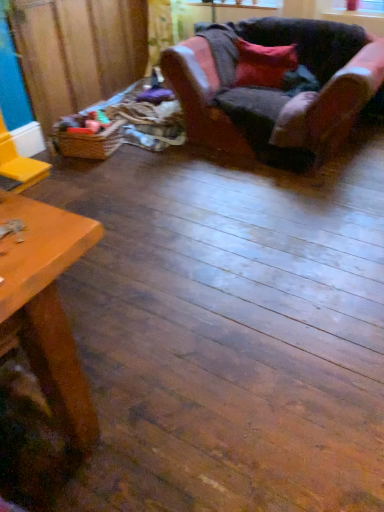
The height and width of the screenshot is (512, 384). Find the location of `brown woven basket at left`. brown woven basket at left is located at coordinates (77, 51).

Find the location of a particular element. The height and width of the screenshot is (512, 384). velvet-like pink armchair at upper right is located at coordinates (277, 90).

Image resolution: width=384 pixels, height=512 pixels. I want to click on plywood above the velvet-like pink armchair at upper right (from the image's perspective), so click(x=77, y=51).

How different are the orientations of velvet-like pink armchair at upper right and brown woven basket at left in degrees?

89.8 degrees separate the facing orientations of velvet-like pink armchair at upper right and brown woven basket at left.

From a real-world perspective, which is physically below, velvet-like pink armchair at upper right or brown woven basket at left?

velvet-like pink armchair at upper right, from a real-world perspective.

Choose the correct answer: Is velvet-like pink armchair at upper right inside brown woven basket at left or outside it?

velvet-like pink armchair at upper right exists outside the volume of brown woven basket at left.

Is woven brown basket at left next to velvet red pillow at upper right?

No.

From the image's perspective, who appears lower, woven brown basket at left or velvet red pillow at upper right?

woven brown basket at left, from the image's perspective.

From a real-world perspective, is woven brown basket at left under velvet red pillow at upper right?

Yes, from a real-world perspective, woven brown basket at left is under velvet red pillow at upper right.

Between woven brown basket at left and velvet red pillow at upper right, which one has more height?

velvet red pillow at upper right is taller.

Can we say woven brown basket at left lies outside velvet-like pink armchair at upper right?

Yes, woven brown basket at left is outside of velvet-like pink armchair at upper right.

What's the angular difference between woven brown basket at left and velvet-like pink armchair at upper right's facing directions?

104 degrees.

Which is more to the left, woven brown basket at left or velvet-like pink armchair at upper right?

woven brown basket at left.

Is point (107, 135) farther from camera compared to point (221, 25)?

No, it is in front of (221, 25).

The height and width of the screenshot is (512, 384). Find the location of `chair on the left of transparent plastic window screen at upper center`. chair on the left of transparent plastic window screen at upper center is located at coordinates (277, 90).

Does velvet-like pink armchair at upper right lie behind transparent plastic window screen at upper center?

No, it is in front of transparent plastic window screen at upper center.

Is velvet-like pink armchair at upper right turned away from transparent plastic window screen at upper center?

Yes, velvet-like pink armchair at upper right is facing away from transparent plastic window screen at upper center.

How much distance is there between velvet red pillow at upper right and woven brown basket at left?

They are 1.16 meters apart.

Would you say velvet red pillow at upper right is inside or outside woven brown basket at left?

velvet red pillow at upper right is spatially situated outside woven brown basket at left.

Where is `pillow above the woven brown basket at left (from the image's perspective)`? pillow above the woven brown basket at left (from the image's perspective) is located at coordinates (264, 64).

Between velvet red pillow at upper right and woven brown basket at left, which one has smaller size?

woven brown basket at left is smaller.

From their relative heights in the image, would you say brown woven basket at left is taller or shorter than velvet-like pink armchair at upper right?

Considering their sizes, brown woven basket at left has more height than velvet-like pink armchair at upper right.

From the image's perspective, would you say brown woven basket at left is positioned over velvet-like pink armchair at upper right?

Indeed, from the image's perspective, brown woven basket at left is shown above velvet-like pink armchair at upper right.

How much distance is there between brown woven basket at left and velvet-like pink armchair at upper right?

brown woven basket at left is 1.17 meters away from velvet-like pink armchair at upper right.

Is brown woven basket at left facing away from velvet-like pink armchair at upper right?

That's not correct — brown woven basket at left is not looking away from velvet-like pink armchair at upper right.

Is brown woven basket at left to the left of transparent plastic window screen at upper center from the viewer's perspective?

Yes, brown woven basket at left is to the left of transparent plastic window screen at upper center.

Is brown woven basket at left not near transparent plastic window screen at upper center?

Absolutely, brown woven basket at left is distant from transparent plastic window screen at upper center.

From a real-world perspective, is brown woven basket at left located higher than transparent plastic window screen at upper center?

No, from a real-world perspective, brown woven basket at left is not on top of transparent plastic window screen at upper center.

Locate an element on the screen. This screenshot has width=384, height=512. chair lying on the right of brown woven basket at left is located at coordinates (277, 90).

Where is `toy that appears on the left of velvet red pillow at upper right`? The width and height of the screenshot is (384, 512). toy that appears on the left of velvet red pillow at upper right is located at coordinates (87, 135).

Estimate the real-world distances between objects in this image. Which object is further from brown woven basket at left, woven brown basket at left or velvet red pillow at upper right?

Based on the image, velvet red pillow at upper right appears to be further to brown woven basket at left.

Considering their positions, is transparent plastic window screen at upper center positioned further to brown woven basket at left than velvet-like pink armchair at upper right?

Based on the image, transparent plastic window screen at upper center appears to be further to brown woven basket at left.

In the scene shown: Estimate the real-world distances between objects in this image. Which object is further from brown woven basket at left, velvet red pillow at upper right or velvet-like pink armchair at upper right?

Among the two, velvet red pillow at upper right is located further to brown woven basket at left.

Considering their positions, is transparent plastic window screen at upper center positioned closer to velvet-like pink armchair at upper right than brown woven basket at left?

Among the two, transparent plastic window screen at upper center is located nearer to velvet-like pink armchair at upper right.

Estimate the real-world distances between objects in this image. Which object is closer to woven brown basket at left, transparent plastic window screen at upper center or velvet-like pink armchair at upper right?

Based on the image, velvet-like pink armchair at upper right appears to be nearer to woven brown basket at left.

When comparing their distances from woven brown basket at left, does velvet red pillow at upper right or brown woven basket at left seem further?

velvet red pillow at upper right is positioned further to the anchor woven brown basket at left.

Estimate the real-world distances between objects in this image. Which object is further from velvet red pillow at upper right, transparent plastic window screen at upper center or velvet-like pink armchair at upper right?

Based on the image, transparent plastic window screen at upper center appears to be further to velvet red pillow at upper right.

Which object lies further to the anchor point woven brown basket at left, velvet-like pink armchair at upper right or transparent plastic window screen at upper center?

transparent plastic window screen at upper center.

You are a GUI agent. You are given a task and a screenshot of the screen. Output one action in this format:
    pyautogui.click(x=<x>, y=<y>)
    Task: Click on the pillow between woven brown basket at left and velvet-like pink armchair at upper right in the horizontal direction
    Image resolution: width=384 pixels, height=512 pixels.
    Given the screenshot: What is the action you would take?
    pyautogui.click(x=264, y=64)

Identify the location of toy between brown woven basket at left and velvet red pillow at upper right in the horizontal direction. The height and width of the screenshot is (512, 384). (87, 135).

The width and height of the screenshot is (384, 512). Find the location of `pillow situated between brown woven basket at left and transparent plastic window screen at upper center from left to right`. pillow situated between brown woven basket at left and transparent plastic window screen at upper center from left to right is located at coordinates (264, 64).

This screenshot has height=512, width=384. I want to click on pillow located between velvet-like pink armchair at upper right and transparent plastic window screen at upper center in the depth direction, so pos(264,64).